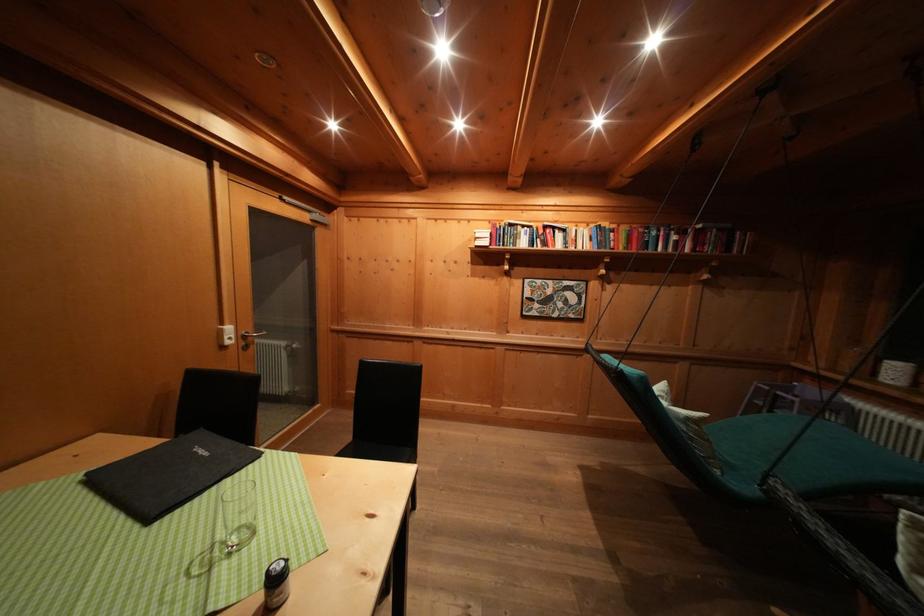
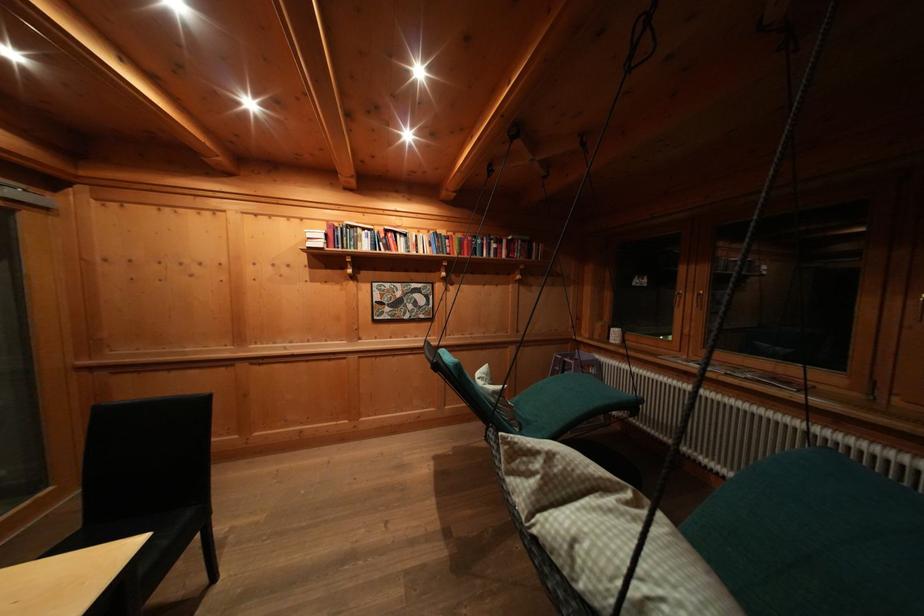
Question: The camera is either moving clockwise (left) or counter-clockwise (right) around the object. The first image is from the beginning of the video and the second image is from the end. Is the camera moving left or right when shooting the video?

Choices:
 (A) Left
 (B) Right

Answer: (A)